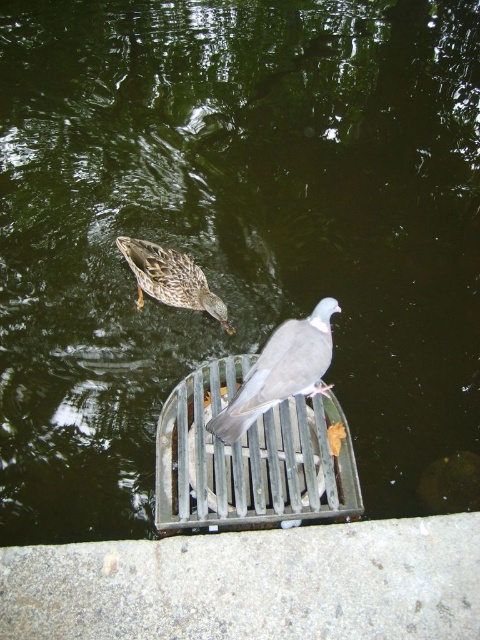
You are standing near the water and want to take a photo of the gray matte pigeon at center without disturbing it. If your camera has a minimum focusing distance of 10 feet, will you be able to take a clear photo from your current position?

The gray matte pigeon at center is 8.28 feet away from the camera. Since the minimum focusing distance is 10 feet, the camera cannot focus clearly at 8.28 feet. You need to move back to ensure the pigeon is at least 10 feet away for a clear photo.

You are a birdwatcher observing the scene. You notice the gray matte pigeon at center and the brown speckled feathers at upper center. Which object is closer to you in the image?

The gray matte pigeon at center is closer to you than the brown speckled feathers at upper center because it is positioned in front of them.

You are standing near the water and see the gray matte pigeon at center and the brown speckled feathers at upper center. Which object is located higher in the image?

The brown speckled feathers at upper center are higher in the image than the gray matte pigeon at center because the gray matte pigeon at center is positioned under them.